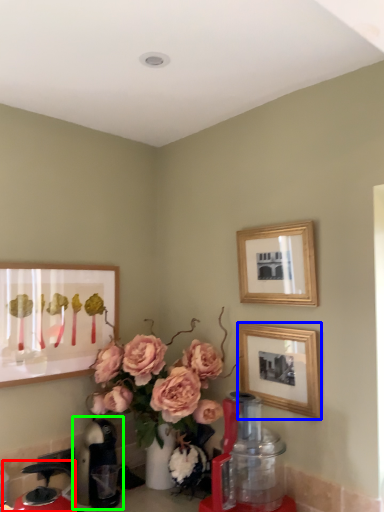
Question: Based on their relative distances, which object is nearer to coffeepot (highlighted by a red box)? Choose from picture frame (highlighted by a blue box) and coffeepot (highlighted by a green box).

Choices:
 (A) picture frame
 (B) coffeepot

Answer: (B)